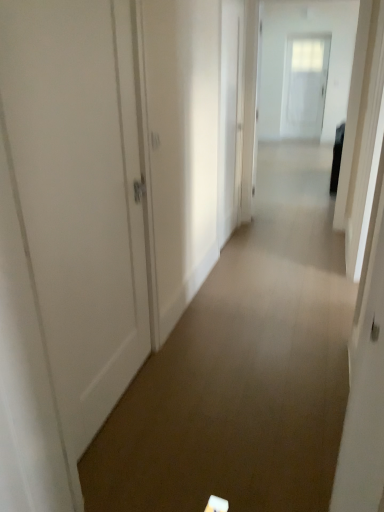
Question: Is white glossy door at center, acting as the second door starting from the right, inside the boundaries of white glossy door at upper center, the first door viewed from the back, or outside?

Choices:
 (A) outside
 (B) inside

Answer: (A)

Question: Considering the positions of white glossy door at center, which ranks as the 2th door in left-to-right order, and white glossy door at upper center, arranged as the third door when viewed from the front, in the image, is white glossy door at center, which ranks as the 2th door in left-to-right order, wider or thinner than white glossy door at upper center, arranged as the third door when viewed from the front,?

Choices:
 (A) thin
 (B) wide

Answer: (A)

Question: Which object is positioned farthest from the white glossy door at upper center, the first door viewed from the back?

Choices:
 (A) white glossy door at upper center
 (B) white glossy door at center, which is the 2th door in bottom-to-top order
 (C) white matte door at left, which is the third door from top to bottom

Answer: (C)

Question: Which of these objects is positioned farthest from the white glossy door at upper center, the first door viewed from the back?

Choices:
 (A) white glossy door at upper center
 (B) white glossy door at center, the 2th door viewed from the front
 (C) white matte door at left, which ranks as the first door in bottom-to-top order

Answer: (C)